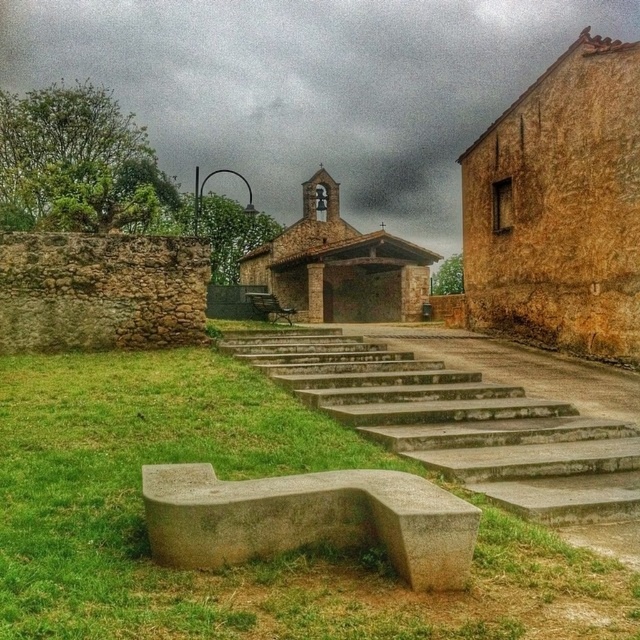
You are standing at the bottom of the steps leading to the church and see two points marked on the ground. The first point is at coordinates point (577, 628) and the second is at point (378, 486). Which point is closer to you?

Point (577, 628) is in front of point (378, 486), so the first point is closer to you.

You are standing at the bottom of the steps leading to the church and see the green grass at lower left and the gray concrete bench at lower left. Which object is higher relative to your position?

The green grass at lower left is higher than the gray concrete bench at lower left because it is positioned above it.